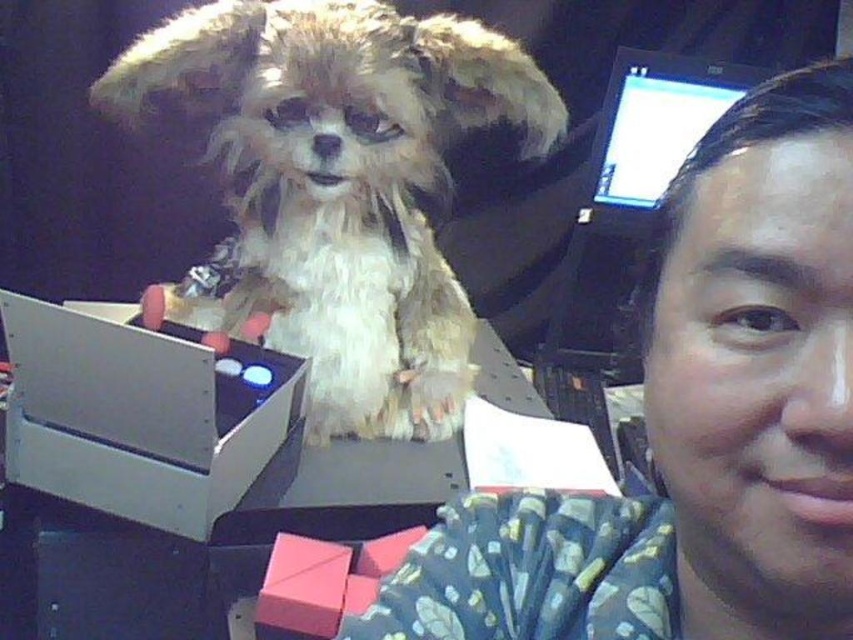
You are standing in a room where a small fluffy dog is sitting inside a shoebox. You notice two points marked in the scene. The first point is at coordinates point (x=386, y=68) and the second point is at point (x=596, y=218). Which of these two points is closer to you?

Point (x=386, y=68) is closer to the viewer than point (x=596, y=218).

You are a delivery person who just arrived at a house to drop off a package. You see a shoebox on the doorstep. Inside the shoebox, there is a red object. You also notice a point marked at coordinates (335, 186). What is located at that point?

The point at coordinates (335, 186) has a fuzzy beige dog at center.